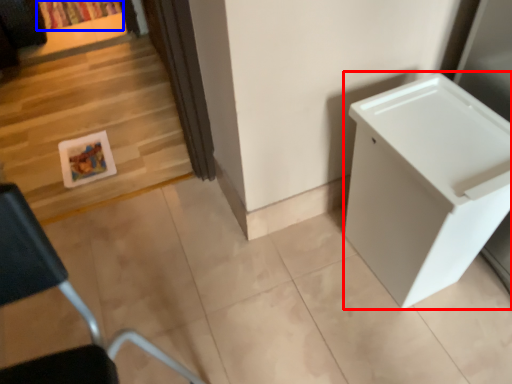
Question: Which object appears farthest to the camera in this image, changing table (highlighted by a red box) or curtain (highlighted by a blue box)?

Choices:
 (A) changing table
 (B) curtain

Answer: (B)